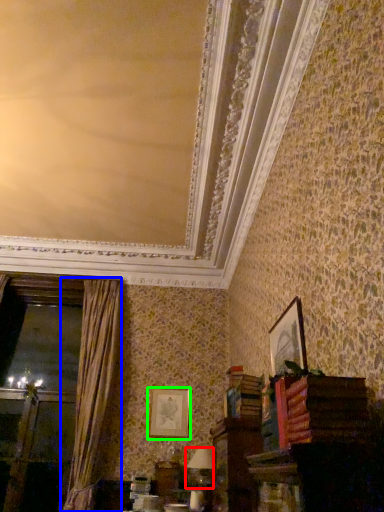
Question: Which object is positioned farthest from table lamp (highlighted by a red box)? Select from curtain (highlighted by a blue box) and picture frame (highlighted by a green box).

Choices:
 (A) curtain
 (B) picture frame

Answer: (A)